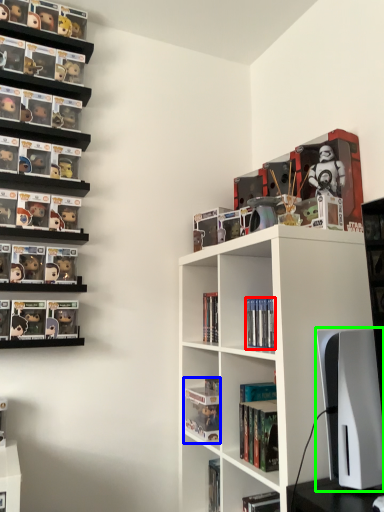
Question: Considering the real-world distances, which object is farthest from book (highlighted by a red box)? book (highlighted by a blue box) or computer monitor (highlighted by a green box)?

Choices:
 (A) book
 (B) computer monitor

Answer: (A)